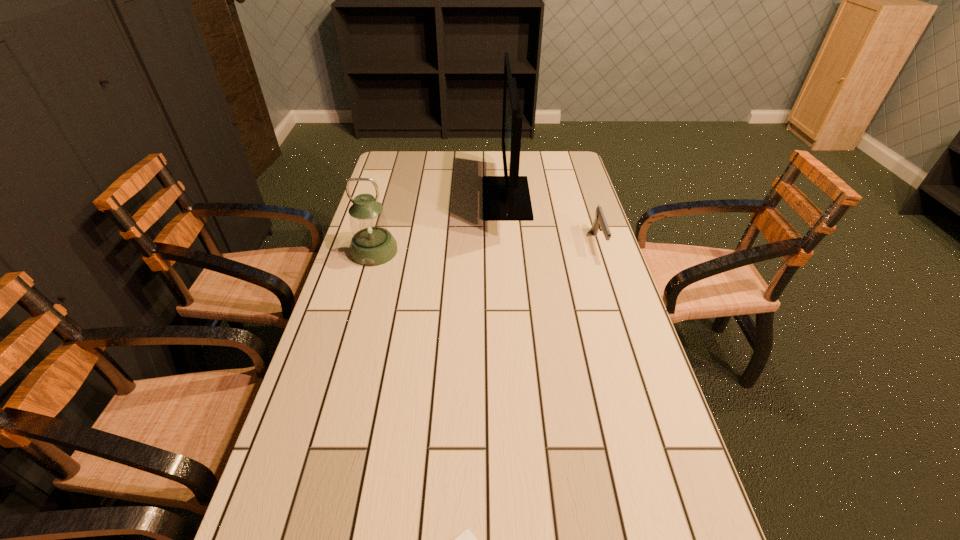
This screenshot has height=540, width=960. Identify the location of vacant space that is in between the rightmost object and the leftmost object. (486, 247).

Where is `vacant space that's between the pistol and the third shortest object`? This screenshot has height=540, width=960. vacant space that's between the pistol and the third shortest object is located at coordinates 486,247.

Identify the location of vacant region between the second shortest object and the monitor. Image resolution: width=960 pixels, height=540 pixels. (552, 221).

This screenshot has height=540, width=960. I want to click on blank region between the tallest object and the lantern, so click(x=441, y=225).

The width and height of the screenshot is (960, 540). Find the location of `object that is the second nearest to the shortest object`. object that is the second nearest to the shortest object is located at coordinates (600, 223).

Locate which object ranks in proximity to the pistol. Please provide its 2D coordinates. Your answer should be formatted as a tuple, i.e. [(x, y)], where the tuple contains the x and y coordinates of a point satisfying the conditions above.

[(505, 198)]